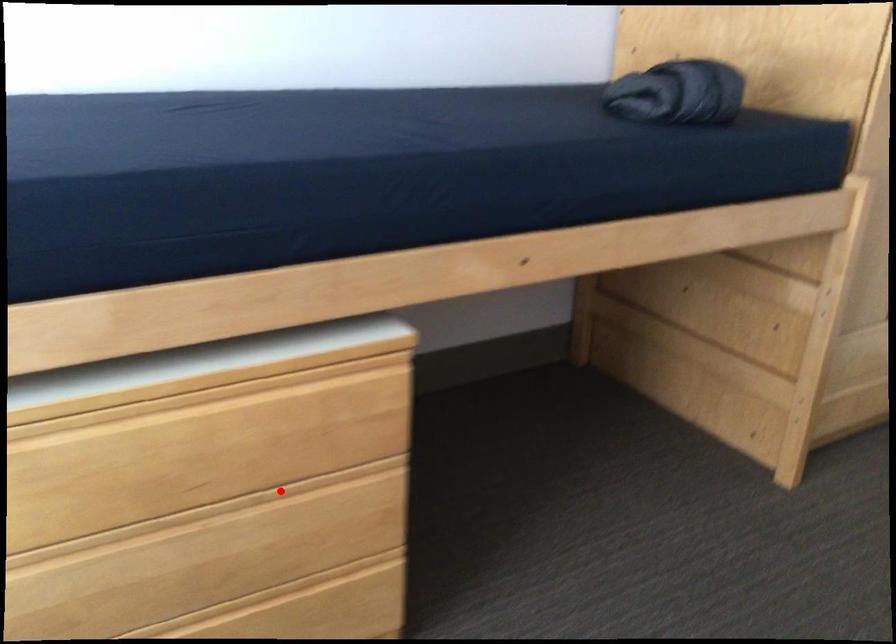
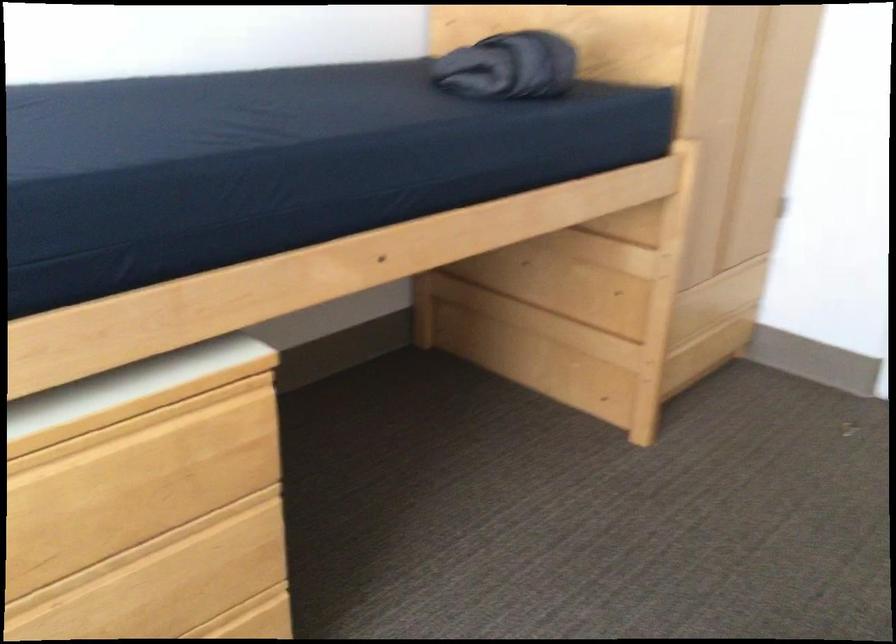
The point at the highlighted location is marked in the first image. Where is the corresponding point in the second image?

(135, 554)